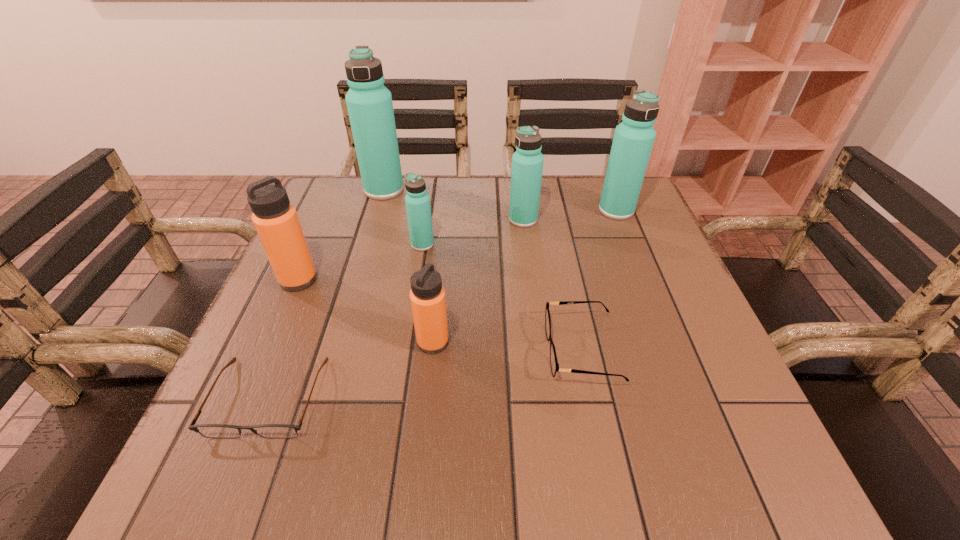
You are a GUI agent. You are given a task and a screenshot of the screen. Output one action in this format:
    pyautogui.click(x=<x>, y=<y>)
    Task: Click on the free space between the fifth thermos bottle from left to right and the right orange thermos bottle
    This screenshot has height=540, width=960.
    Given the screenshot: What is the action you would take?
    pyautogui.click(x=478, y=281)

Find the location of a particular element. The width and height of the screenshot is (960, 540). free space between the second smallest aqua thermos bottle and the bigger orange thermos bottle is located at coordinates (411, 249).

At what (x,y) coordinates should I click in order to perform the action: click on free space between the rightmost thermos bottle and the farthest thermos bottle. Please return your answer as a coordinate pair (x, y). The width and height of the screenshot is (960, 540). Looking at the image, I should click on (500, 200).

At what (x,y) coordinates should I click in order to perform the action: click on unoccupied area between the left orange thermos bottle and the shorter spectacles. Please return your answer as a coordinate pair (x, y). This screenshot has width=960, height=540. Looking at the image, I should click on (283, 338).

At what (x,y) coordinates should I click in order to perform the action: click on free space between the farthest object and the taller spectacles. Please return your answer as a coordinate pair (x, y). The width and height of the screenshot is (960, 540). Looking at the image, I should click on (483, 270).

I want to click on free space between the second shortest object and the smallest aqua thermos bottle, so click(502, 298).

Locate an element on the screen. The width and height of the screenshot is (960, 540). free space between the third nearest thermos bottle and the fifth thermos bottle from right to left is located at coordinates (403, 217).

Locate an element on the screen. This screenshot has width=960, height=540. object that is the seventh closest to the fifth farthest object is located at coordinates (633, 140).

Choose which object is the fourth nearest neighbor to the left spectacles. Please provide its 2D coordinates. Your answer should be formatted as a tuple, i.e. [(x, y)], where the tuple contains the x and y coordinates of a point satisfying the conditions above.

[(554, 364)]

At what (x,y) coordinates should I click in order to perform the action: click on the fifth closest thermos bottle relative to the rightmost aqua thermos bottle. Please return your answer as a coordinate pair (x, y). Image resolution: width=960 pixels, height=540 pixels. Looking at the image, I should click on (275, 219).